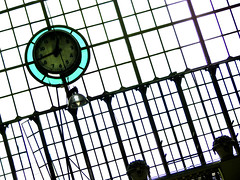
I want to click on clock, so (59, 50).